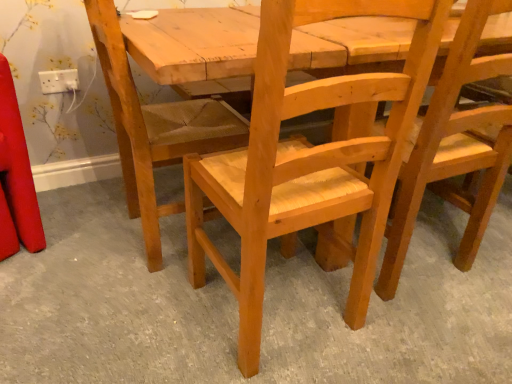
Question: From a real-world perspective, is natural wood chair at center positioned under natural wood chair at center, the 1th chair viewed from the right, based on gravity?

Choices:
 (A) no
 (B) yes

Answer: (B)

Question: Is natural wood chair at center to the left of natural wood chair at center, the 1th chair viewed from the right, from the viewer's perspective?

Choices:
 (A) no
 (B) yes

Answer: (B)

Question: Does natural wood chair at center come in front of natural wood chair at center, the 1th chair viewed from the right?

Choices:
 (A) yes
 (B) no

Answer: (A)

Question: Is natural wood chair at center positioned far away from natural wood chair at center, which ranks as the third chair in left-to-right order?

Choices:
 (A) no
 (B) yes

Answer: (A)

Question: Is natural wood chair at center, the 1th chair viewed from the right, inside natural wood chair at center?

Choices:
 (A) yes
 (B) no

Answer: (B)

Question: Is natural wood chair at center oriented towards natural wood chair at center, the 1th chair viewed from the right?

Choices:
 (A) yes
 (B) no

Answer: (B)

Question: Are natural wood chair at center and natural wood chair at center, the third chair positioned from the right, located far from each other?

Choices:
 (A) yes
 (B) no

Answer: (B)

Question: Is natural wood chair at center positioned before natural wood chair at center, marked as the 1th chair in a left-to-right arrangement?

Choices:
 (A) no
 (B) yes

Answer: (B)

Question: Can you confirm if natural wood chair at center is positioned to the left of natural wood chair at center, marked as the 1th chair in a left-to-right arrangement?

Choices:
 (A) no
 (B) yes

Answer: (A)

Question: Does natural wood chair at center appear on the right side of natural wood chair at center, the third chair positioned from the right?

Choices:
 (A) no
 (B) yes

Answer: (B)

Question: Does natural wood chair at center have a larger size compared to natural wood chair at center, marked as the 1th chair in a left-to-right arrangement?

Choices:
 (A) no
 (B) yes

Answer: (B)

Question: Can natural wood chair at center, the third chair positioned from the right, be found inside natural wood chair at center?

Choices:
 (A) no
 (B) yes

Answer: (A)

Question: Are natural wood chair at center and natural wood chair at center, which is the second chair in right-to-left order, located far from each other?

Choices:
 (A) yes
 (B) no

Answer: (B)